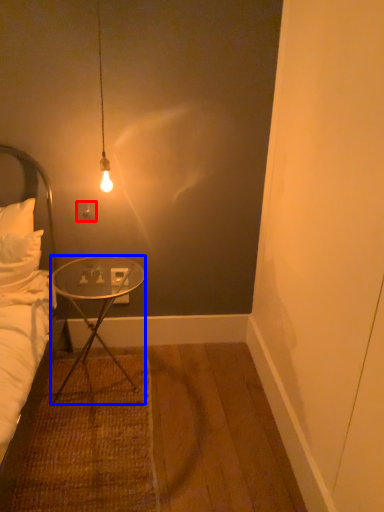
Question: Which object appears farthest to the camera in this image, power outlet (highlighted by a red box) or desk (highlighted by a blue box)?

Choices:
 (A) power outlet
 (B) desk

Answer: (A)